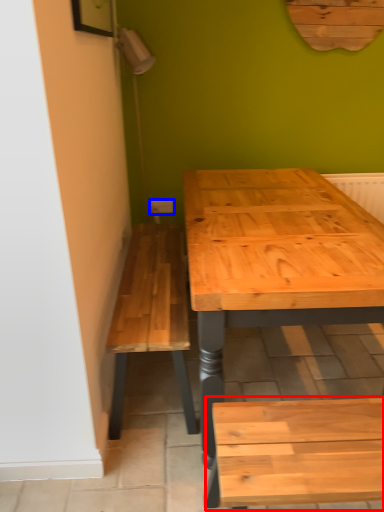
Question: Which object is further to the camera taking this photo, church bench (highlighted by a red box) or electric outlet (highlighted by a blue box)?

Choices:
 (A) church bench
 (B) electric outlet

Answer: (B)